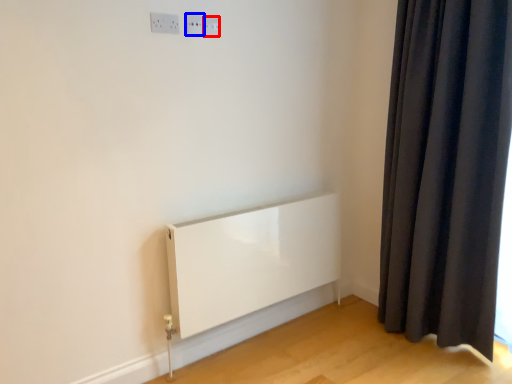
Question: Which of the following is the farthest to the observer, electric outlet (highlighted by a red box) or electric outlet (highlighted by a blue box)?

Choices:
 (A) electric outlet
 (B) electric outlet

Answer: (A)